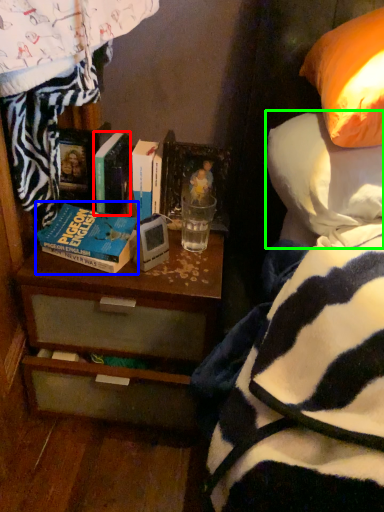
Question: Which is farther away from book (highlighted by a red box)? book (highlighted by a blue box) or pillow (highlighted by a green box)?

Choices:
 (A) book
 (B) pillow

Answer: (B)